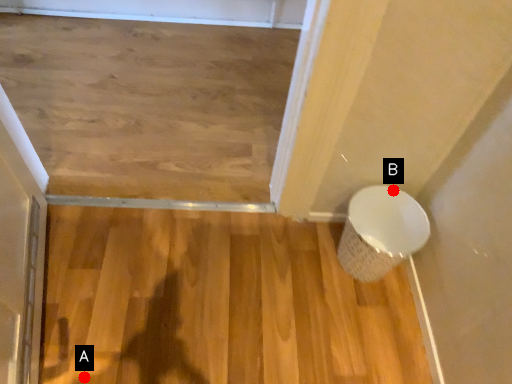
Question: Two points are circled on the image, labeled by A and B beside each circle. Which point is farther from the camera taking this photo?

Choices:
 (A) A is further
 (B) B is further

Answer: (B)